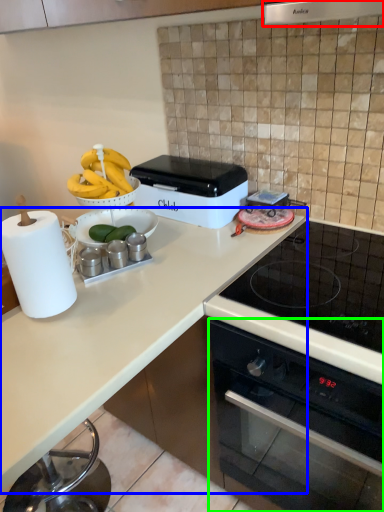
Question: Based on their relative distances, which object is nearer to exhaust hood (highlighted by a red box)? Choose from countertop (highlighted by a blue box) and oven (highlighted by a green box).

Choices:
 (A) countertop
 (B) oven

Answer: (A)